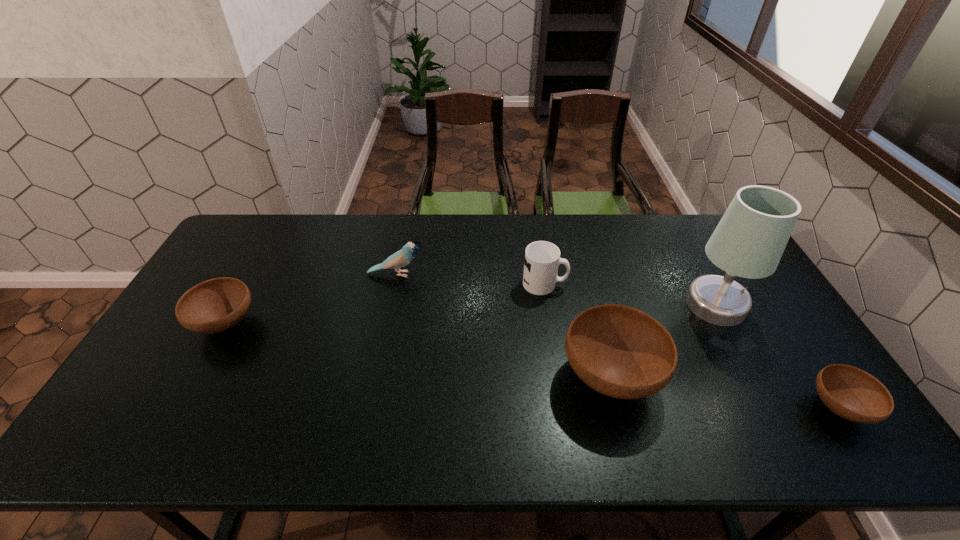
At what (x,y) coordinates should I click in order to perform the action: click on the second tallest bowl. Please return your answer as a coordinate pair (x, y). Image resolution: width=960 pixels, height=540 pixels. Looking at the image, I should click on (215, 305).

You are a GUI agent. You are given a task and a screenshot of the screen. Output one action in this format:
    pyautogui.click(x=<x>, y=<y>)
    Task: Click on the fifth tallest object
    
    Given the screenshot: What is the action you would take?
    pyautogui.click(x=215, y=305)

Where is `the tallest bowl`? The image size is (960, 540). the tallest bowl is located at coordinates (619, 351).

Where is `the rightmost object`? This screenshot has height=540, width=960. the rightmost object is located at coordinates (851, 393).

The height and width of the screenshot is (540, 960). I want to click on the shortest bowl, so click(x=851, y=393).

Locate an element on the screen. the fifth object from right to left is located at coordinates (403, 257).

Find the location of a particular element. The image size is (960, 540). the tallest object is located at coordinates (749, 241).

Locate an element on the screen. lampshade is located at coordinates (749, 241).

The height and width of the screenshot is (540, 960). Find the location of `mug`. mug is located at coordinates (542, 259).

In order to click on vacant space located 0.350m on the right of the second shortest bowl in this screenshot , I will do `click(378, 323)`.